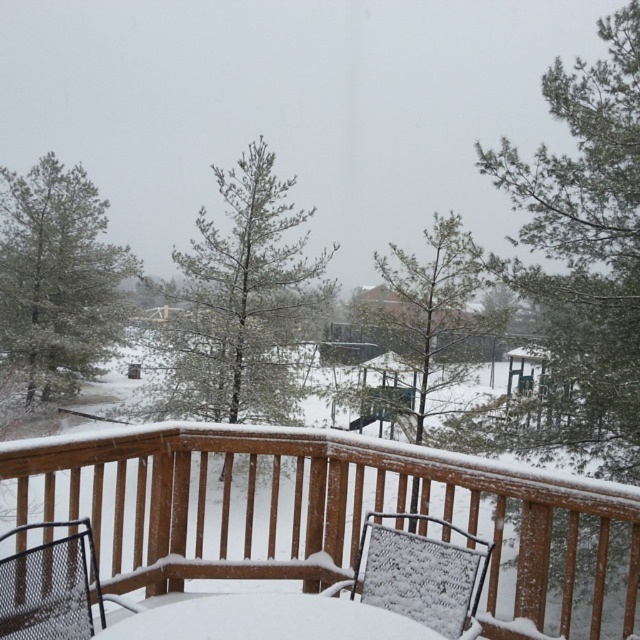
Question: Which is nearer to the snow-covered wooden balcony at center?

Choices:
 (A) snow-covered pine tree at left
 (B) green needle-like tree at center

Answer: (B)

Question: Which of the following is the farthest from the observer?

Choices:
 (A) metal mesh chair at lower left
 (B) green needle-like tree at center
 (C) snow-covered wooden balcony at center
 (D) snow-covered pine tree at left

Answer: (D)

Question: Does snow-covered wooden balcony at center lie behind white mesh chair at center?

Choices:
 (A) no
 (B) yes

Answer: (B)

Question: Is green matte tree at upper right to the left of white mesh chair at center from the viewer's perspective?

Choices:
 (A) yes
 (B) no

Answer: (B)

Question: Which is nearer to the snow-covered pine tree at left?

Choices:
 (A) white snow-covered table at center
 (B) metal mesh chair at lower left
 (C) green matte tree at center

Answer: (C)

Question: Can you confirm if snow-covered pine tree at left is positioned to the right of metal mesh chair at lower left?

Choices:
 (A) no
 (B) yes

Answer: (A)